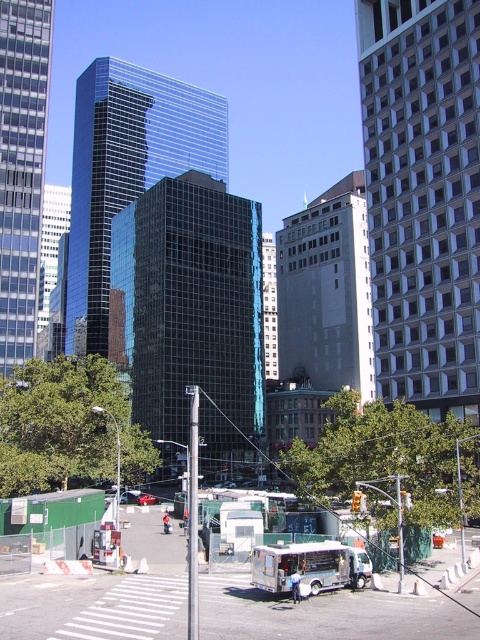
Does green plastic containers at center have a greater width compared to metallic red car at center?

Yes.

Is green plastic containers at center below metallic red car at center?

Actually, green plastic containers at center is above metallic red car at center.

The image size is (480, 640). What are the coordinates of `green plastic containers at center` in the screenshot? It's located at (105, 595).

Between point (253, 586) and point (144, 502), which one is positioned behind?

The point (144, 502) is behind.

Is white metallic food truck at center closer to camera compared to metallic red car at center?

Yes.

Locate an element on the screen. white metallic food truck at center is located at coordinates (300, 566).

This screenshot has height=640, width=480. What do you see at coordinates (105, 595) in the screenshot? I see `green plastic containers at center` at bounding box center [105, 595].

Is green plastic containers at center closer to the viewer compared to white metallic food truck at center?

Yes, green plastic containers at center is in front of white metallic food truck at center.

Who is more forward, (396,637) or (283,556)?

Point (396,637)

This screenshot has height=640, width=480. In order to click on green plastic containers at center in this screenshot , I will do `click(105, 595)`.